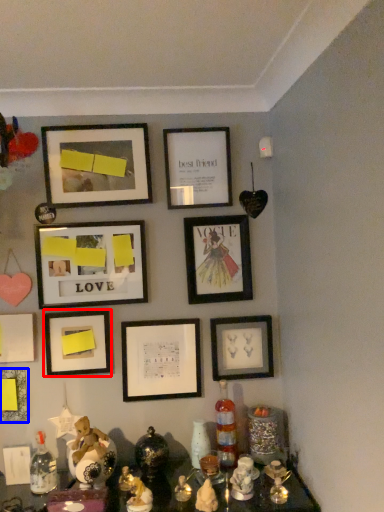
Question: Which object is closer to the camera taking this photo, picture frame (highlighted by a red box) or picture frame (highlighted by a blue box)?

Choices:
 (A) picture frame
 (B) picture frame

Answer: (B)